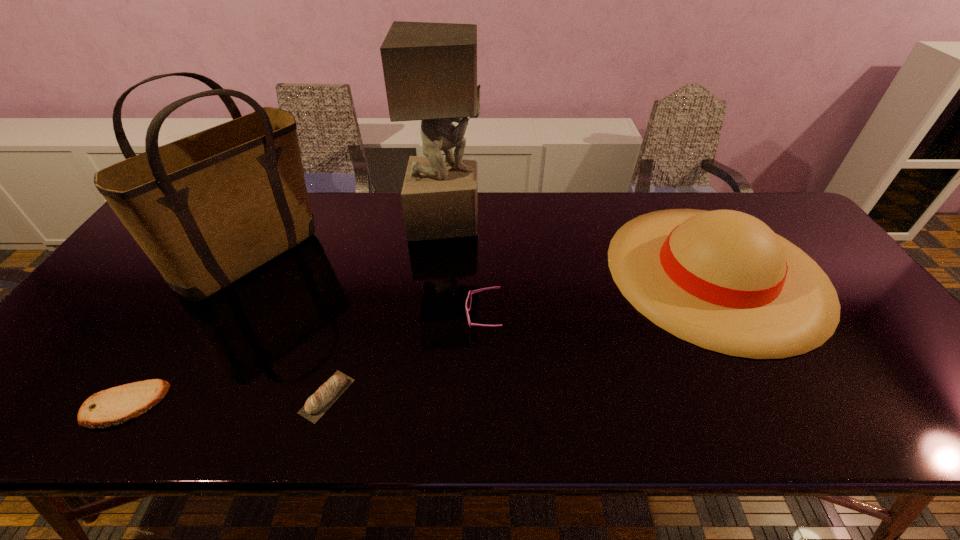
Identify the location of sculpture. (430, 69).

Locate an element on the screen. This screenshot has height=540, width=960. tote bag is located at coordinates (207, 209).

Image resolution: width=960 pixels, height=540 pixels. I want to click on sombrero, so [723, 280].

Find the location of a particular element. The width and height of the screenshot is (960, 540). the fourth shortest object is located at coordinates (723, 280).

Where is `sunglasses`? sunglasses is located at coordinates (468, 302).

You are a GUI agent. You are given a task and a screenshot of the screen. Output one action in this format:
    pyautogui.click(x=<x>, y=<y>)
    Task: Click on the right pita bread
    This screenshot has height=540, width=960.
    Given the screenshot: What is the action you would take?
    pyautogui.click(x=317, y=404)

The image size is (960, 540). In order to click on the left pita bread in this screenshot , I will do `click(107, 408)`.

Locate an element on the screen. free space located on the front-facing side of the sculpture is located at coordinates (584, 220).

At what (x,y) coordinates should I click in order to perform the action: click on vacant space situated on the right of the tote bag. Please return your answer as a coordinate pair (x, y). This screenshot has height=540, width=960. Looking at the image, I should click on (403, 256).

Identify the location of free spot located 0.050m on the back of the third tallest object. Image resolution: width=960 pixels, height=540 pixels. (677, 201).